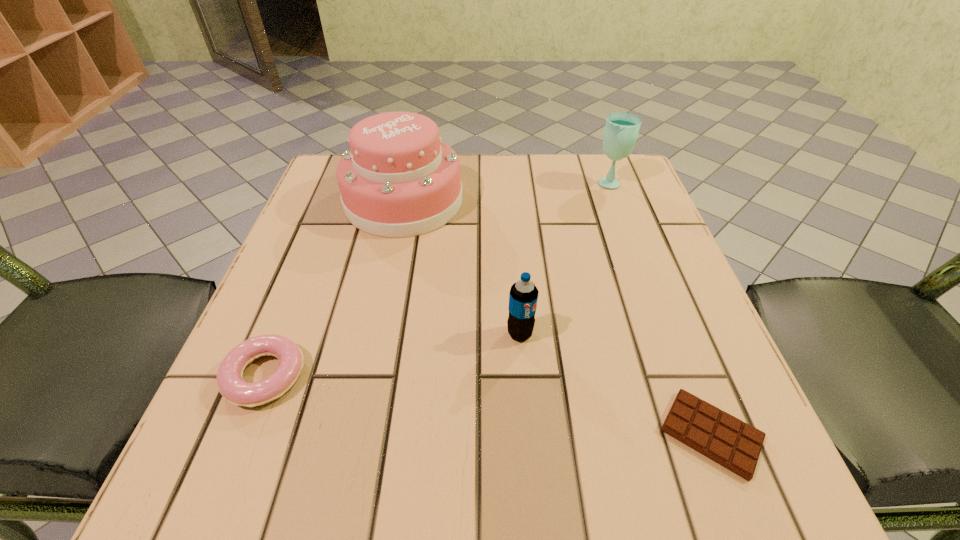
The image size is (960, 540). Identify the location of cake. (399, 179).

You are a GUI agent. You are given a task and a screenshot of the screen. Output one action in this format:
    pyautogui.click(x=<x>, y=<y>)
    Task: Click on the glass
    
    Given the screenshot: What is the action you would take?
    pyautogui.click(x=621, y=130)

What are the coordinates of `soda bottle` in the screenshot? It's located at (523, 296).

Where is `the third shortest object`? The width and height of the screenshot is (960, 540). the third shortest object is located at coordinates (523, 296).

Identify the location of the fourth tallest object. (233, 388).

Identify the location of the shortest object. The height and width of the screenshot is (540, 960). (730, 442).

Where is `vacant space located on the right of the cake`? The height and width of the screenshot is (540, 960). vacant space located on the right of the cake is located at coordinates (584, 201).

You are a GUI agent. You are given a task and a screenshot of the screen. Output one action in this format:
    pyautogui.click(x=<x>, y=<y>)
    Task: Click on the vacant space located 0.280m on the left of the glass
    This screenshot has width=960, height=540.
    Given the screenshot: What is the action you would take?
    pyautogui.click(x=475, y=181)

This screenshot has height=540, width=960. I want to click on free space located on the left of the third object from right to left, so click(310, 334).

Where is `vacant space located 0.250m on the right of the fourth tallest object`? The width and height of the screenshot is (960, 540). vacant space located 0.250m on the right of the fourth tallest object is located at coordinates (470, 376).